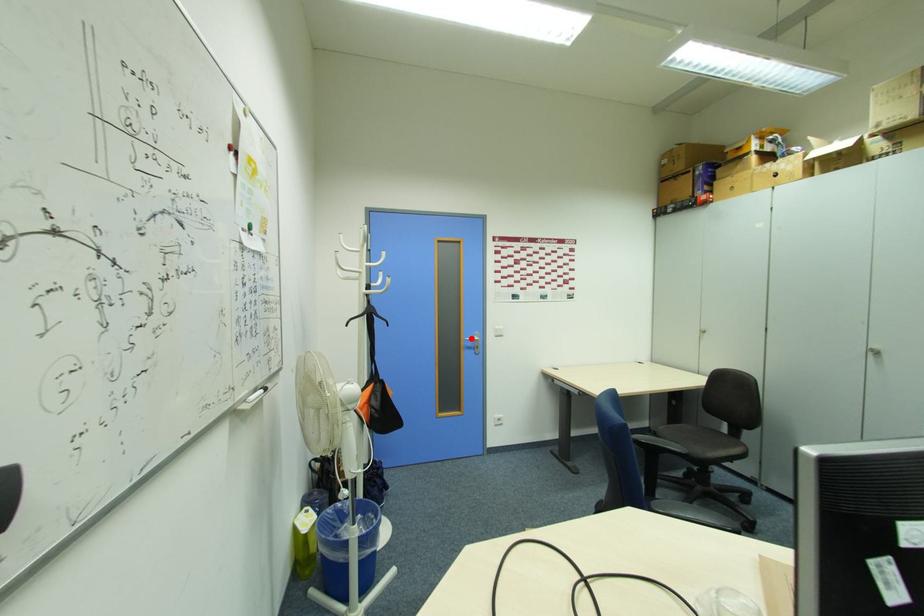
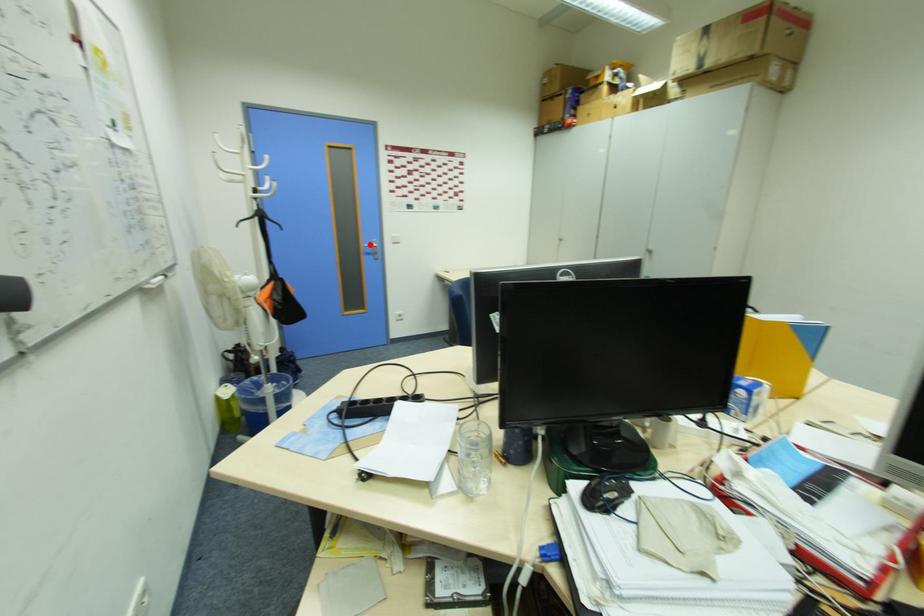
I am providing you with two images of the same scene from different viewpoints. A red point is marked on the first image and another point is marked on the second image. Are the points marked in image1 and image2 representing the same 3D position?

Yes